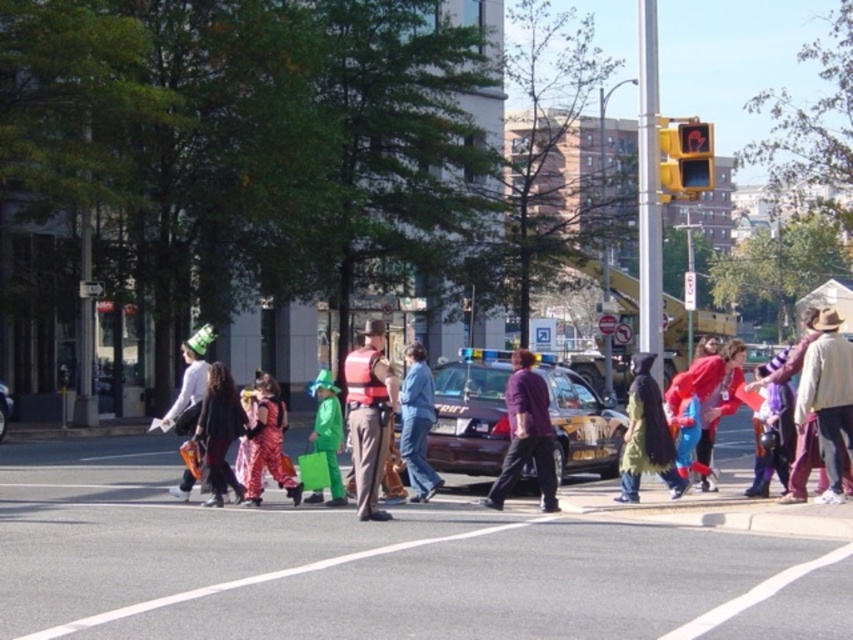
Question: From the image, what is the correct spatial relationship of denim pants at center in relation to metallic silver car at center?

Choices:
 (A) right
 (B) left

Answer: (A)

Question: Does dark brown asphalt at center have a lesser width compared to striped fabric dress at center?

Choices:
 (A) yes
 (B) no

Answer: (B)

Question: Which point is closer to the camera taking this photo?

Choices:
 (A) (776, 464)
 (B) (817, 380)
 (C) (218, 397)

Answer: (B)

Question: Which is farther from the metallic silver car at center?

Choices:
 (A) green matte costume at center
 (B) dark brown asphalt at center
 (C) denim pants at center

Answer: (B)

Question: Which of the following is the farthest from the observer?

Choices:
 (A) (316, 497)
 (B) (422, 499)

Answer: (B)

Question: Is dark brown asphalt at center below metallic silver car at center?

Choices:
 (A) no
 (B) yes

Answer: (B)